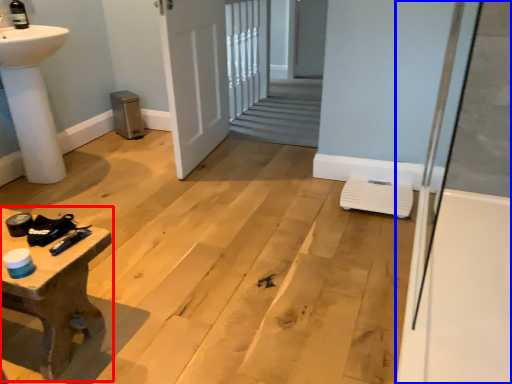
Question: Which object is further to the camera taking this photo, table (highlighted by a red box) or bath (highlighted by a blue box)?

Choices:
 (A) table
 (B) bath

Answer: (A)